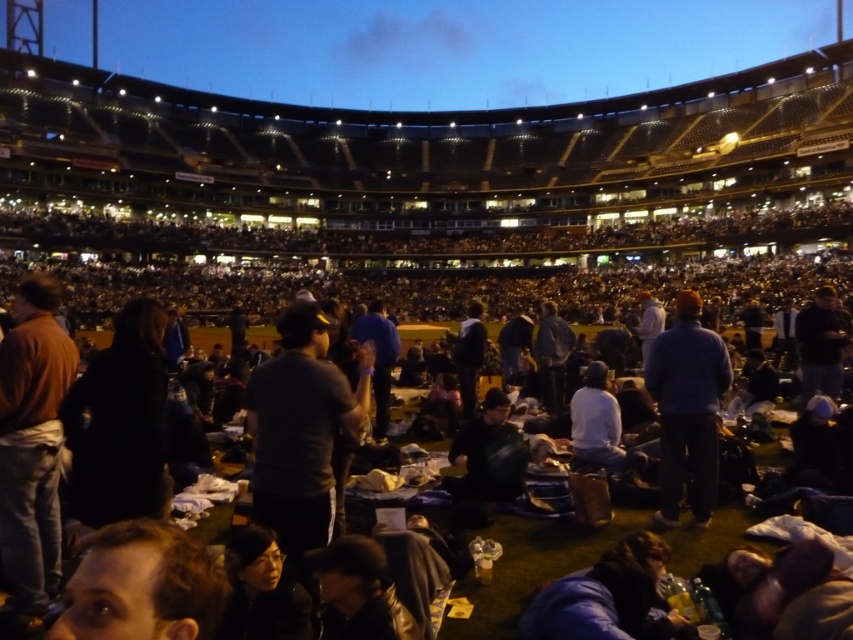
Who is higher up, dark gray shirt at center or brown hair at lower left?

Positioned higher is dark gray shirt at center.

Which of these two, dark gray shirt at center or brown hair at lower left, stands taller?

dark gray shirt at center is taller.

Who is more distant from viewer, (310, 368) or (184, 618)?

Point (310, 368)

Find the location of a particular element. The height and width of the screenshot is (640, 853). dark gray shirt at center is located at coordinates (300, 428).

Locate an element on the screen. The width and height of the screenshot is (853, 640). blue denim jeans at center is located at coordinates (688, 408).

Which is behind, point (676, 397) or point (494, 481)?

Positioned behind is point (676, 397).

Between point (700, 404) and point (503, 400), which one is positioned in front?

Positioned in front is point (700, 404).

This screenshot has width=853, height=640. I want to click on blue denim jeans at center, so click(x=688, y=408).

Which is in front, point (305, 531) or point (32, 289)?

Point (305, 531) is in front.

Describe the element at coordinates (300, 428) in the screenshot. I see `dark gray shirt at center` at that location.

This screenshot has width=853, height=640. I want to click on dark gray shirt at center, so click(300, 428).